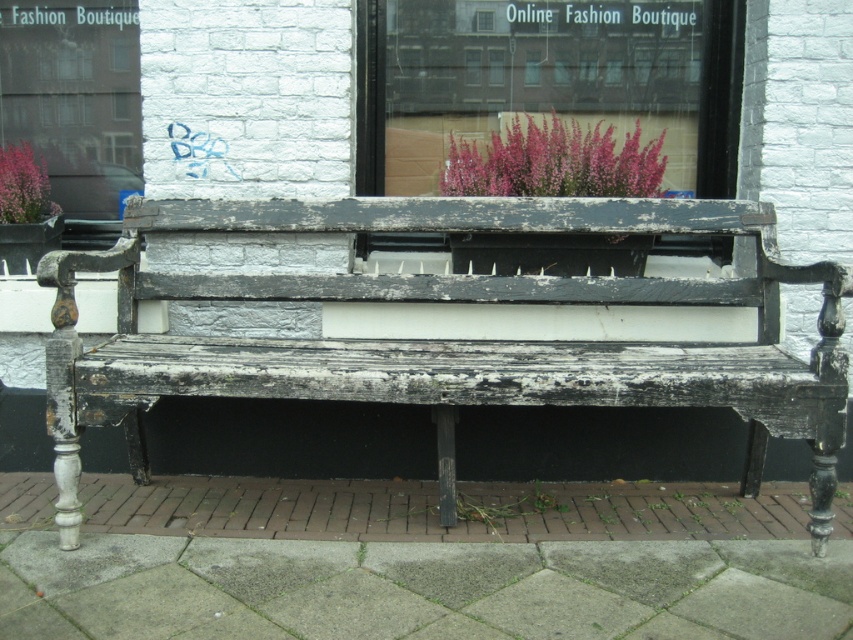
Question: Can you confirm if concrete paving at lower center is positioned to the right of matte pink flowers at upper left?

Choices:
 (A) yes
 (B) no

Answer: (A)

Question: Which object is farther from the camera taking this photo?

Choices:
 (A) distressed wood bench at center
 (B) concrete paving at lower center
 (C) matte pink flowers at upper left

Answer: (C)

Question: Considering the relative positions of distressed wood bench at center and matte pink flowers at upper left in the image provided, where is distressed wood bench at center located with respect to matte pink flowers at upper left?

Choices:
 (A) right
 (B) left

Answer: (A)

Question: Is distressed wood bench at center above matte pink flowers at upper left?

Choices:
 (A) yes
 (B) no

Answer: (B)

Question: Estimate the real-world distances between objects in this image. Which object is closer to the pink fluffy plant at upper center?

Choices:
 (A) concrete paving at lower center
 (B) distressed wood bench at center

Answer: (B)

Question: Which object appears closest to the camera in this image?

Choices:
 (A) distressed wood bench at center
 (B) matte pink flowers at upper left
 (C) pink fluffy plant at upper center
 (D) concrete paving at lower center

Answer: (D)